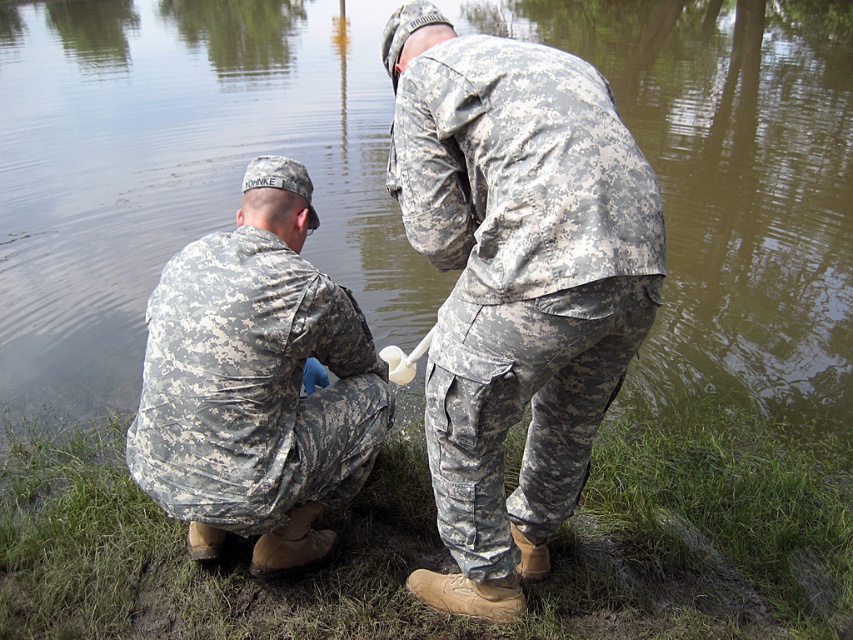
Question: Which point is closer to the camera?

Choices:
 (A) camouflage fabric pants at lower center
 (B) camouflage fabric uniform at left

Answer: (A)

Question: Which point is closer to the camera?

Choices:
 (A) camouflage fabric pants at lower center
 (B) camouflage fabric uniform at left

Answer: (A)

Question: Is camouflage fabric pants at lower center to the right of camouflage fabric uniform at left from the viewer's perspective?

Choices:
 (A) no
 (B) yes

Answer: (B)

Question: Which of the following is the closest to the observer?

Choices:
 (A) (503, 349)
 (B) (163, 451)

Answer: (A)

Question: Can you confirm if camouflage fabric pants at lower center is positioned to the right of camouflage fabric uniform at left?

Choices:
 (A) no
 (B) yes

Answer: (B)

Question: Is camouflage fabric pants at lower center above camouflage fabric uniform at left?

Choices:
 (A) no
 (B) yes

Answer: (B)